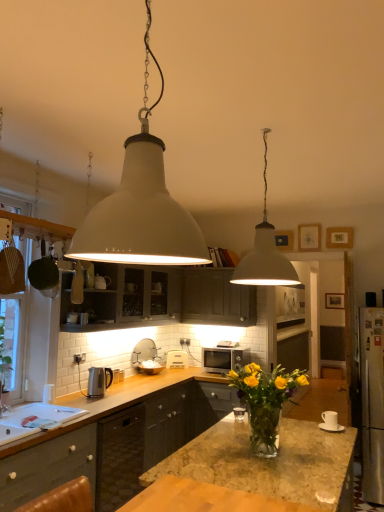
Question: From the image's perspective, is satin silver microwave at center over translucent glass vase at center?

Choices:
 (A) yes
 (B) no

Answer: (B)

Question: Is satin silver microwave at center next to translucent glass vase at center?

Choices:
 (A) yes
 (B) no

Answer: (B)

Question: From the image's perspective, is satin silver microwave at center below translucent glass vase at center?

Choices:
 (A) yes
 (B) no

Answer: (A)

Question: Is there a large distance between satin silver microwave at center and translucent glass vase at center?

Choices:
 (A) no
 (B) yes

Answer: (B)

Question: From a real-world perspective, does satin silver microwave at center sit lower than translucent glass vase at center?

Choices:
 (A) no
 (B) yes

Answer: (B)

Question: Is satin silver microwave at center smaller than translucent glass vase at center?

Choices:
 (A) yes
 (B) no

Answer: (A)

Question: Can you confirm if dark gray wood cabinet at center, which is the third cabinetry from front to back, is wider than white glossy sink at lower left?

Choices:
 (A) yes
 (B) no

Answer: (B)

Question: Could you tell me if dark gray wood cabinet at center, which is counted as the first cabinetry, starting from the back, is facing white glossy sink at lower left?

Choices:
 (A) no
 (B) yes

Answer: (B)

Question: Is dark gray wood cabinet at center, which is counted as the first cabinetry, starting from the back, not inside white glossy sink at lower left?

Choices:
 (A) yes
 (B) no

Answer: (A)

Question: From the image's perspective, does dark gray wood cabinet at center, which is the third cabinetry from front to back, appear lower than white glossy sink at lower left?

Choices:
 (A) yes
 (B) no

Answer: (B)

Question: Considering the relative sizes of dark gray wood cabinet at center, which is the third cabinetry from front to back, and white glossy sink at lower left in the image provided, is dark gray wood cabinet at center, which is the third cabinetry from front to back, smaller than white glossy sink at lower left?

Choices:
 (A) no
 (B) yes

Answer: (A)

Question: Is dark gray wood cabinet at center, which is the third cabinetry from front to back, taller than white glossy sink at lower left?

Choices:
 (A) yes
 (B) no

Answer: (A)

Question: Are white matte picture frame at upper center, the third picture frame from the right, and white matte pendant light at upper center, the 2th lamp viewed from the right, far apart?

Choices:
 (A) no
 (B) yes

Answer: (B)